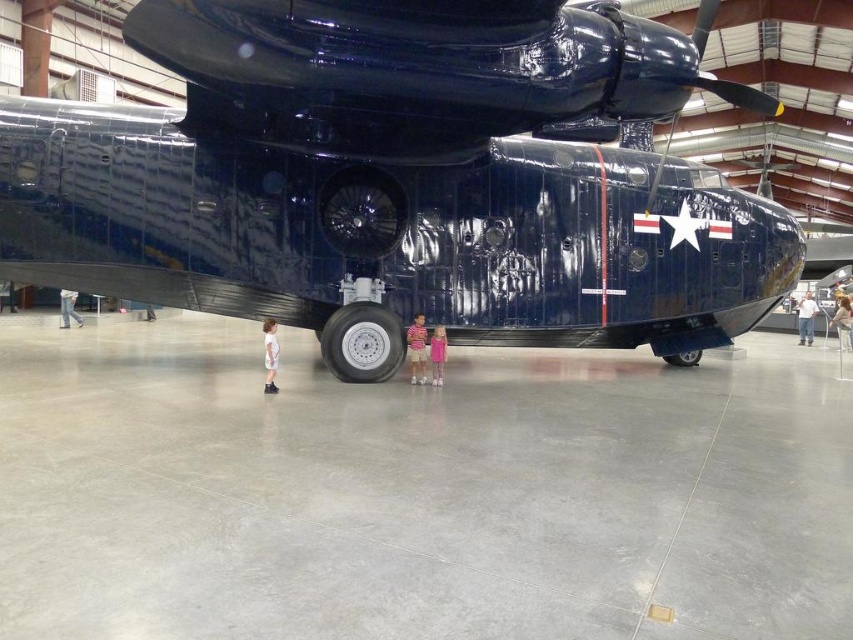
Is striped shirt at center above pink fabric dress at lower center?

Indeed, striped shirt at center is positioned over pink fabric dress at lower center.

The width and height of the screenshot is (853, 640). In order to click on striped shirt at center in this screenshot , I will do pos(416,349).

Does striped shirt at center appear on the left side of light blue shirt at lower right?

Indeed, striped shirt at center is positioned on the left side of light blue shirt at lower right.

Which is more to the left, striped shirt at center or light blue shirt at lower right?

From the viewer's perspective, striped shirt at center appears more on the left side.

Which is in front, point (422, 372) or point (840, 305)?

Positioned in front is point (422, 372).

Image resolution: width=853 pixels, height=640 pixels. I want to click on striped shirt at center, so click(x=416, y=349).

Which is behind, point (434, 336) or point (802, 320)?

Positioned behind is point (802, 320).

Which is in front, point (437, 333) or point (805, 310)?

Positioned in front is point (437, 333).

This screenshot has height=640, width=853. Find the location of `pink fabric dress at center`. pink fabric dress at center is located at coordinates click(x=437, y=353).